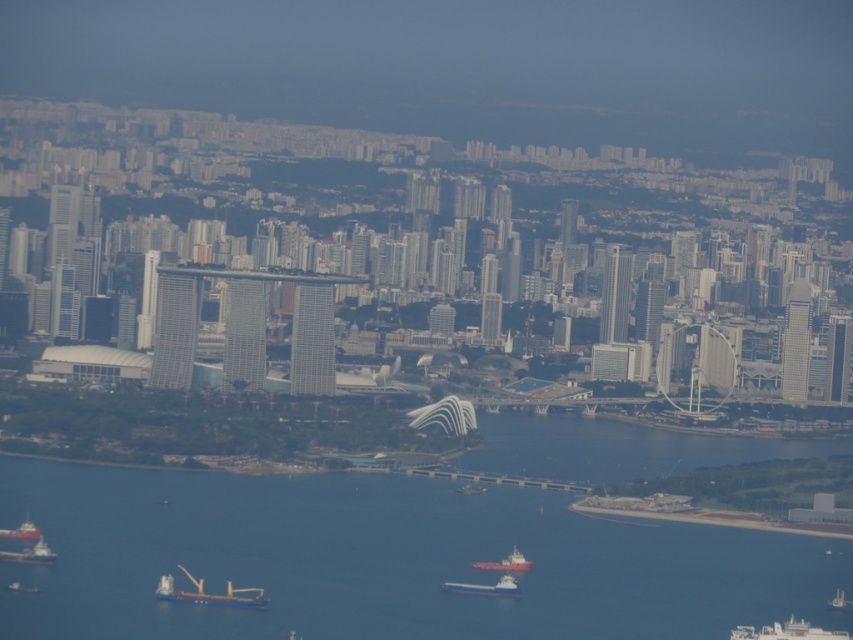
Question: Does blue metallic cargo ship at lower left have a larger size compared to white matte boat at lower right?

Choices:
 (A) no
 (B) yes

Answer: (A)

Question: Does blue water at lower center have a lesser width compared to blue metallic boat at center?

Choices:
 (A) yes
 (B) no

Answer: (B)

Question: Which of the following is the closest to the observer?

Choices:
 (A) metallic blue ship at center
 (B) metallic blue ship at lower center

Answer: (A)

Question: Based on their relative distances, which object is farther from the white matte boat at lower left?

Choices:
 (A) red matte cargo ship at lower left
 (B) blue matte cargo ship at lower right
 (C) blue metallic cargo ship at lower left
 (D) blue metallic boat at center

Answer: (B)

Question: Which object is the closest to the blue water at lower center?

Choices:
 (A) blue matte cargo ship at lower right
 (B) blue metallic boat at center
 (C) metallic blue ship at center
 (D) blue metallic cargo ship at lower left

Answer: (C)

Question: Is metallic blue ship at lower center thinner than red matte cargo ship at lower left?

Choices:
 (A) no
 (B) yes

Answer: (A)